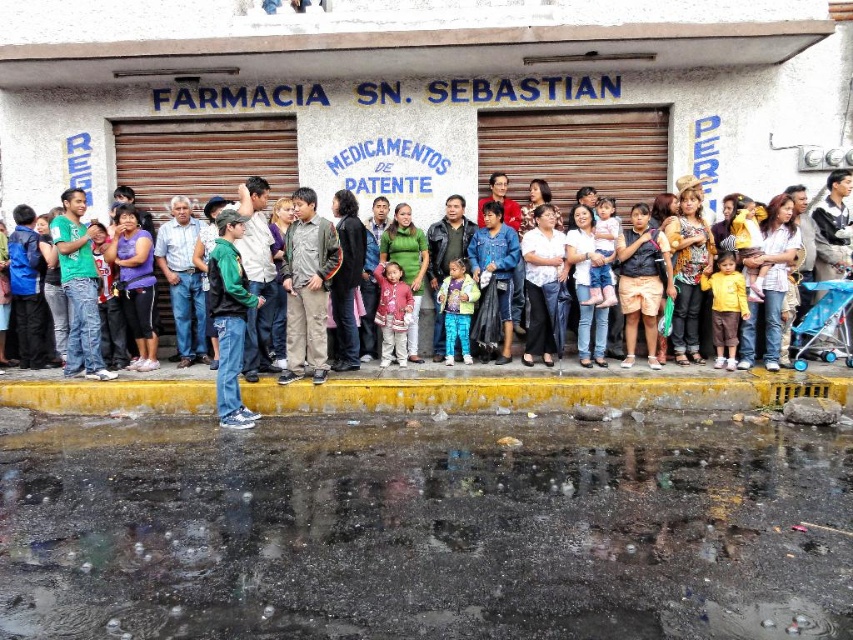
In the scene shown: Is jeans at center above green matte jacket at center?

No.

Does jeans at center have a larger size compared to green matte jacket at center?

Incorrect, jeans at center is not larger than green matte jacket at center.

Measure the distance between point (769, 358) and camera.

Point (769, 358) and camera are 8.98 meters apart.

At what (x,y) coordinates should I click in order to perform the action: click on jeans at center. Please return your answer as a coordinate pair (x, y). Looking at the image, I should click on (688, 272).

Is point (473, 401) positioned in front of point (743, 348)?

Yes, it is.

Who is more forward, (666, 385) or (776, 296)?

Positioned in front is point (666, 385).

Is point (281, 404) farther from viewer compared to point (782, 211)?

No, (281, 404) is in front of (782, 211).

The image size is (853, 640). Identify the location of yellow concrete curb at lower center. (541, 394).

Between green matte jacket at center and matte pink sweater at center, which one has more height?

green matte jacket at center is taller.

Is green matte jacket at center closer to the viewer compared to matte pink sweater at center?

Yes, it is in front of matte pink sweater at center.

Between point (229, 316) and point (389, 260), which one is positioned behind?

Point (389, 260)

Locate an element on the screen. The width and height of the screenshot is (853, 640). green matte jacket at center is located at coordinates (229, 317).